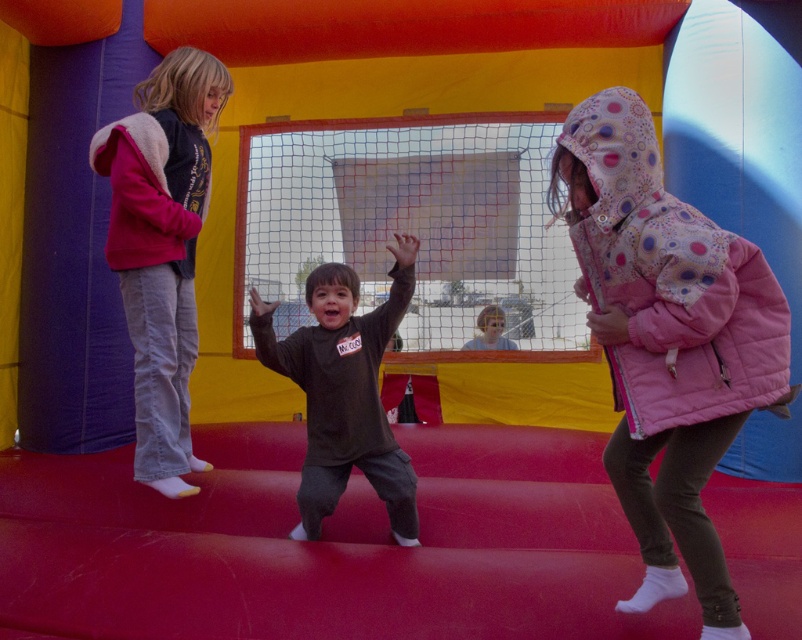
Does point (614, 148) lie in front of point (391, 506)?

Yes, it is.

Who is positioned more to the left, pink quilted jacket at right or dark gray fleece shirt at center?

dark gray fleece shirt at center is more to the left.

Based on the photo, who is more distant from viewer, (671, 404) or (318, 429)?

Point (318, 429)

Locate an element on the screen. The width and height of the screenshot is (802, 640). pink quilted jacket at right is located at coordinates (667, 280).

This screenshot has width=802, height=640. Identify the location of pink quilted jacket at right. (667, 280).

Which is in front, point (572, 148) or point (132, 227)?

Point (572, 148)

The width and height of the screenshot is (802, 640). Identify the location of pink quilted jacket at right. (667, 280).

Does light pink fleece jacket at left appear over pink fleece jacket at upper left?

No, light pink fleece jacket at left is not above pink fleece jacket at upper left.

Which is in front, point (150, 332) or point (126, 230)?

Point (126, 230) is more forward.

Locate an element on the screen. light pink fleece jacket at left is located at coordinates (161, 246).